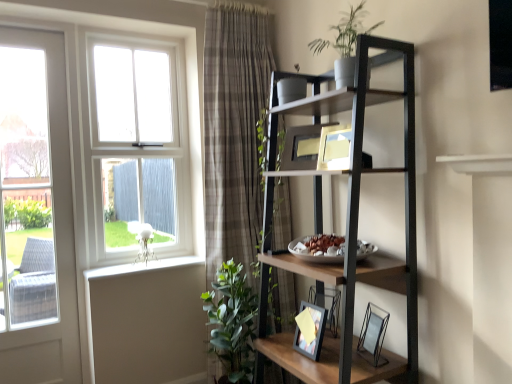
This screenshot has width=512, height=384. Identify the location of vacant region above white glossy door at left (from a real-world perspective). (23, 31).